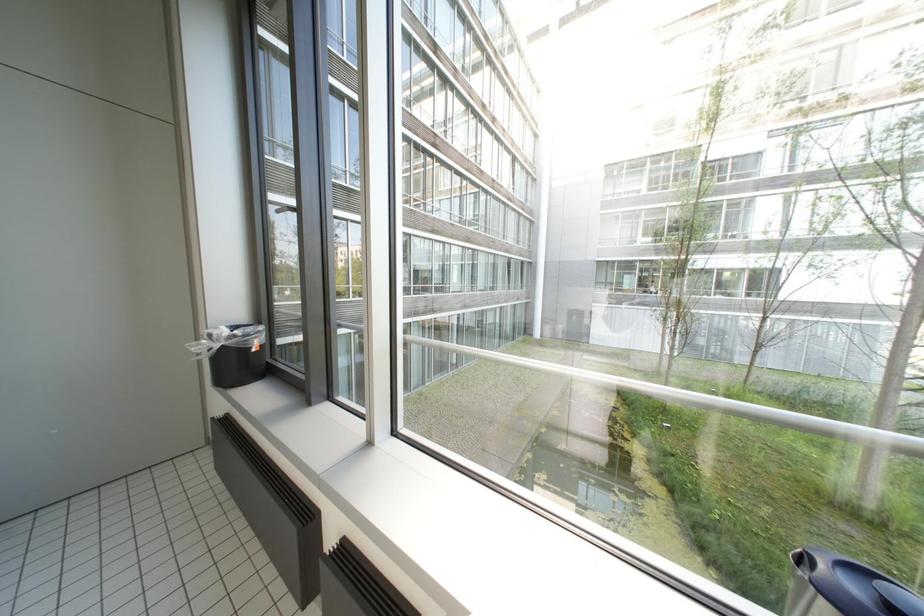
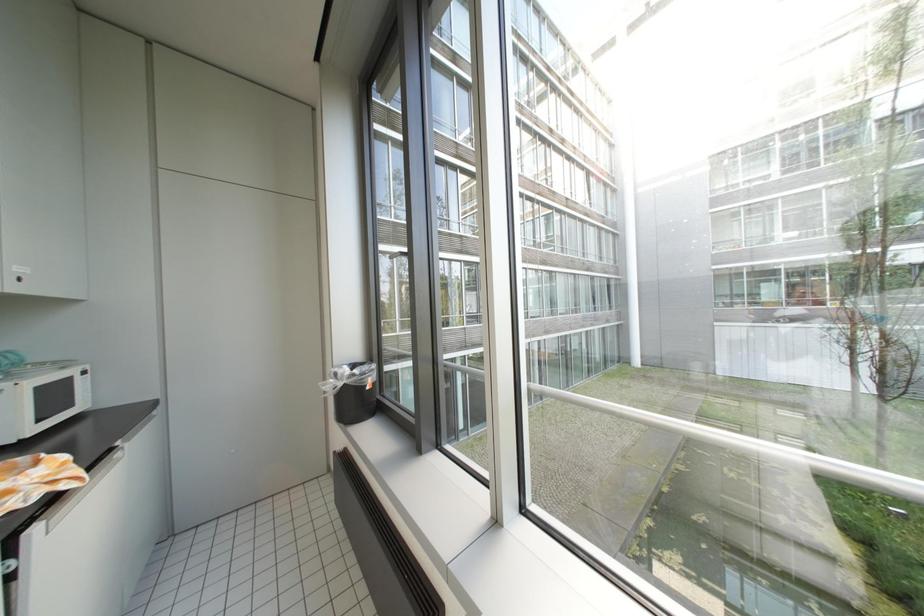
In the scene shown: Which direction would the cameraman need to move to produce the second image?

The cameraman walked toward left, forward.